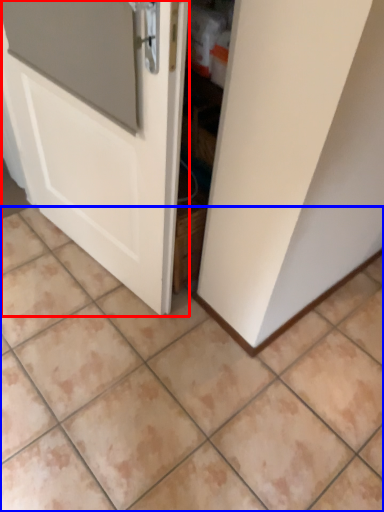
Question: Which object appears closest to the camera in this image, door (highlighted by a red box) or ceramic tile (highlighted by a blue box)?

Choices:
 (A) door
 (B) ceramic tile

Answer: (A)